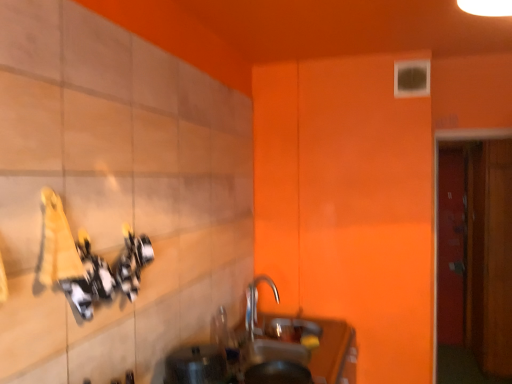
Question: Is metallic silver sink at lower center spatially inside silver metallic tap at center, or outside of it?

Choices:
 (A) outside
 (B) inside

Answer: (A)

Question: Considering the positions of point (202, 357) and point (271, 281), is point (202, 357) closer or farther from the camera than point (271, 281)?

Choices:
 (A) closer
 (B) farther

Answer: (A)

Question: Considering the real-world distances, which object is closest to the wooden door at right, which is counted as the 1th door, starting from the left?

Choices:
 (A) wooden door at right, the second door from the front
 (B) metallic silver sink at lower center
 (C) smooth brown countertop at lower center
 (D) silver metallic tap at center

Answer: (C)

Question: Considering the real-world distances, which object is farthest from the metallic silver sink at lower center?

Choices:
 (A) wooden door at right, which is counted as the 1th door, starting from the left
 (B) smooth brown countertop at lower center
 (C) silver metallic tap at center
 (D) wooden door at right, the second door from the front

Answer: (D)